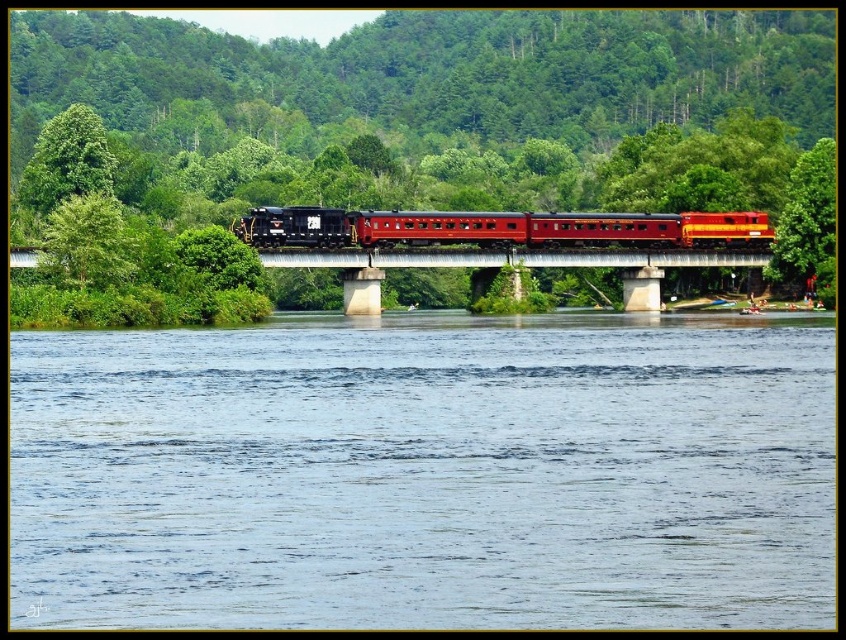
You are a train engineer observing the bridge and the water below. From your vantage point on the train, which object is positioned lower in the scene? The clear blue water at center or the concrete bridge at center?

The clear blue water at center is located below the concrete bridge at center, so it is positioned lower in the scene.

Based on the photo, you are a photographer trying to capture the train crossing the bridge. Based on the scene, which object, the clear blue water at center or the concrete bridge at center, will appear closer to the camera in your photo?

The clear blue water at center will appear closer to the camera because it is positioned in front of the concrete bridge at center.

You are a photographer planning to capture the metallic red train at center and the concrete bridge at center in a single shot. Based on their sizes, which object should you focus on first to ensure both are clearly visible in the photo?

The metallic red train at center is larger than the concrete bridge at center, so you should focus on the metallic red train at center first to ensure both are clearly visible in the photo.